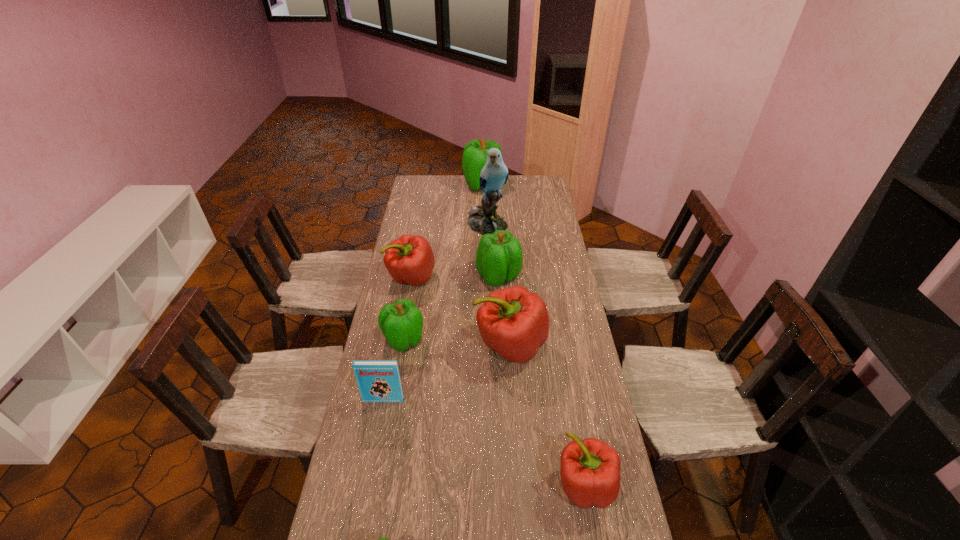
Identify which object is the fifth nearest to the second smallest pink bell pepper. Please provide its 2D coordinates. Your answer should be formatted as a tuple, i.e. [(x, y)], where the tuple contains the x and y coordinates of a point satisfying the conditions above.

[(379, 381)]

Image resolution: width=960 pixels, height=540 pixels. I want to click on object that can be found as the seventh closest to the second nearest bell pepper, so click(483, 219).

Where is `bell pepper that is the third closest to the shortest object`? bell pepper that is the third closest to the shortest object is located at coordinates (401, 323).

Identify which bell pepper is the fifth nearest to the parakeet. Please provide its 2D coordinates. Your answer should be formatted as a tuple, i.e. [(x, y)], where the tuple contains the x and y coordinates of a point satisfying the conditions above.

[(401, 323)]

What are the coordinates of `green bell pepper that is the closest one to the parakeet` in the screenshot? It's located at (499, 257).

Locate which green bell pepper ranks second in proximity to the smallest pink bell pepper. Please provide its 2D coordinates. Your answer should be formatted as a tuple, i.e. [(x, y)], where the tuple contains the x and y coordinates of a point satisfying the conditions above.

[(401, 323)]

Where is `pink bell pepper that can be found as the second closest to the biggest green bell pepper`? Image resolution: width=960 pixels, height=540 pixels. pink bell pepper that can be found as the second closest to the biggest green bell pepper is located at coordinates pos(514,322).

Where is `the closest pink bell pepper relative to the farthest green bell pepper`? the closest pink bell pepper relative to the farthest green bell pepper is located at coordinates (409, 259).

Where is `vacant region that satisfies the following two spatial constraints: 1. on the face of the nearest pink bell pepper; 2. on the left side of the tallest object`? The image size is (960, 540). vacant region that satisfies the following two spatial constraints: 1. on the face of the nearest pink bell pepper; 2. on the left side of the tallest object is located at coordinates (492, 485).

Where is `vacant space that satisfies the following two spatial constraints: 1. on the front side of the farthest green bell pepper; 2. on the left side of the second farthest green bell pepper`? The height and width of the screenshot is (540, 960). vacant space that satisfies the following two spatial constraints: 1. on the front side of the farthest green bell pepper; 2. on the left side of the second farthest green bell pepper is located at coordinates (483, 276).